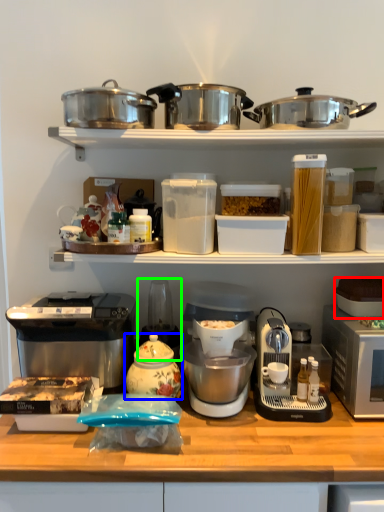
Question: Which is farther away from appliance (highlighted by a red box)? kitchen appliance (highlighted by a blue box) or appliance (highlighted by a green box)?

Choices:
 (A) kitchen appliance
 (B) appliance

Answer: (A)